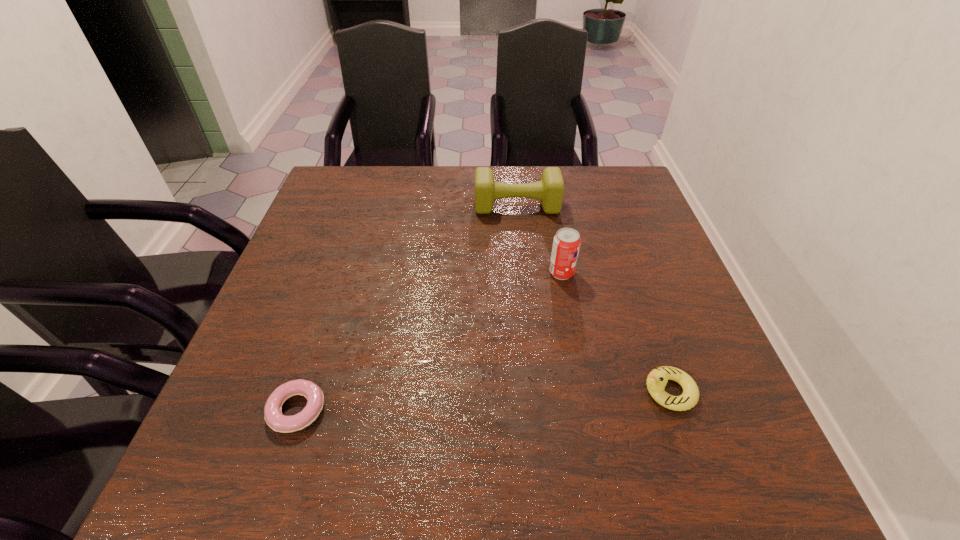
Where is `soda can`? Image resolution: width=960 pixels, height=540 pixels. soda can is located at coordinates (566, 243).

Where is `the farthest object`? This screenshot has height=540, width=960. the farthest object is located at coordinates (550, 189).

You are a GUI agent. You are given a task and a screenshot of the screen. Output one action in this format:
    pyautogui.click(x=<x>, y=<y>)
    Task: Click on the dumbbell
    This screenshot has width=960, height=540.
    Given the screenshot: What is the action you would take?
    pyautogui.click(x=550, y=189)

Locate an element on the screen. Image resolution: width=960 pixels, height=540 pixels. duckling is located at coordinates (657, 379).

Locate an element on the screen. Image resolution: width=960 pixels, height=540 pixels. the rightmost object is located at coordinates (657, 379).

Identify the location of the leftmost object. (273, 416).

The height and width of the screenshot is (540, 960). I want to click on the shortest object, so (x=273, y=416).

The height and width of the screenshot is (540, 960). In order to click on vacant space located on the left of the third nearest object in this screenshot , I will do `click(460, 273)`.

You are a GUI agent. You are given a task and a screenshot of the screen. Output one action in this format:
    pyautogui.click(x=<x>, y=<y>)
    Task: Click on the free space located 0.050m on the right of the second tallest object
    Image resolution: width=960 pixels, height=540 pixels.
    Given the screenshot: What is the action you would take?
    pyautogui.click(x=576, y=206)

The width and height of the screenshot is (960, 540). What are the coordinates of `vacant space positioned on the face of the third tallest object` in the screenshot? It's located at (442, 391).